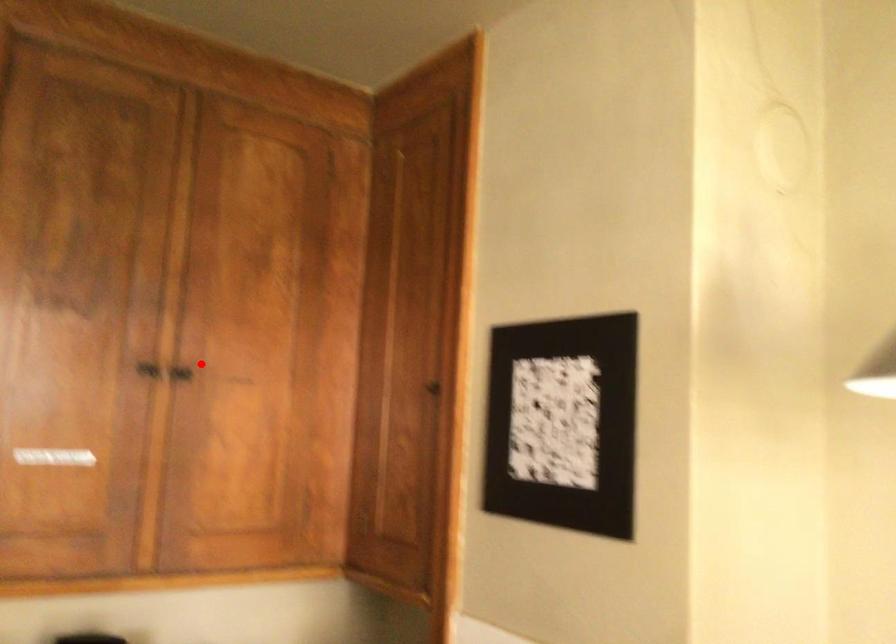
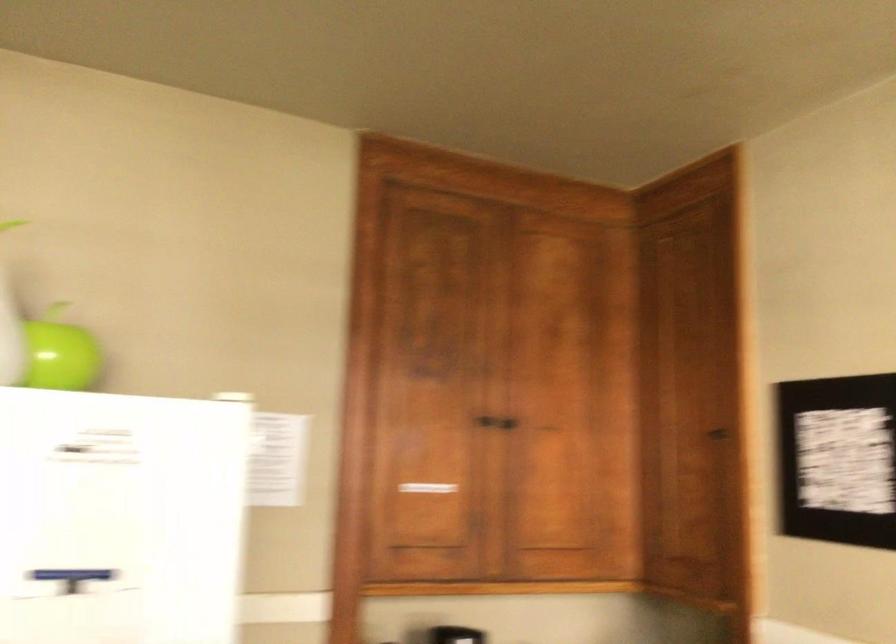
Question: I am providing you with two images of the same scene from different viewpoints. In image1, a red point is highlighted. Considering the same 3D point in image2, which of the following is correct?

Choices:
 (A) It is closer
 (B) It is farther

Answer: (B)